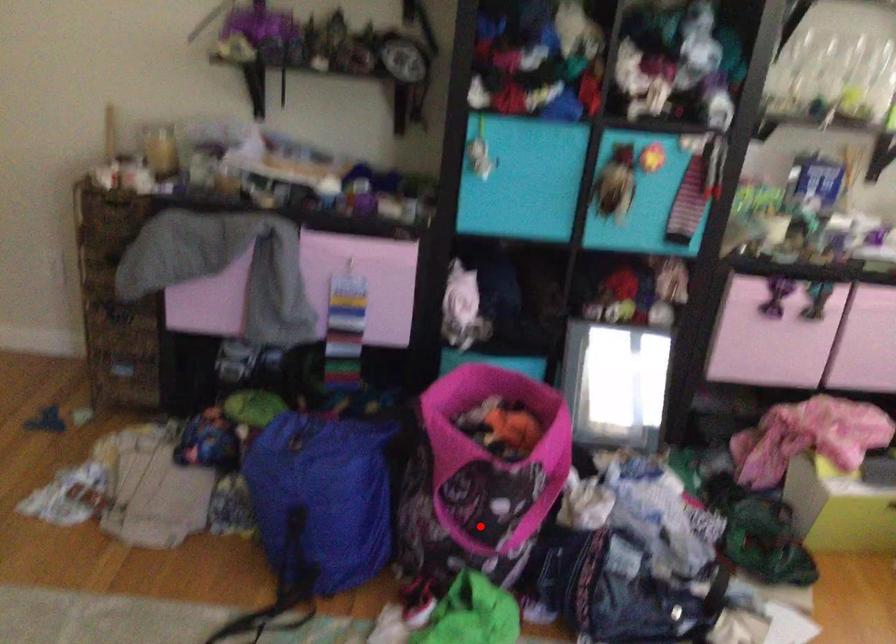
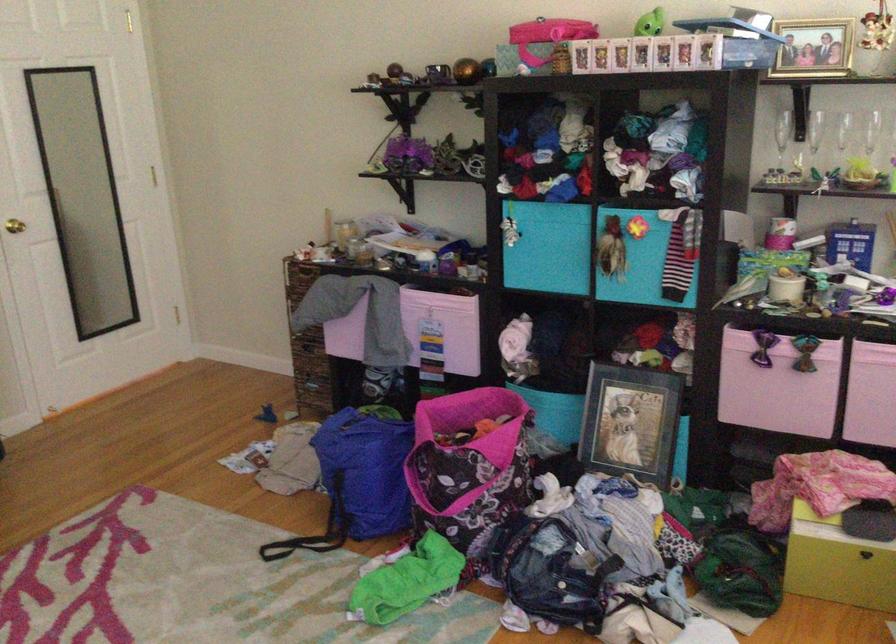
Find the pixel in the second image that matches the highlighted location in the first image.

(440, 498)